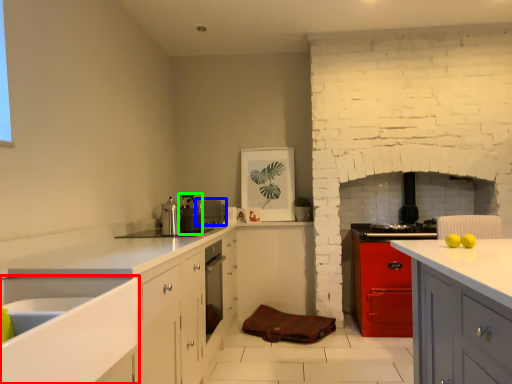
Question: Which object is positioned farthest from sink (highlighted by a red box)? Select from appliance (highlighted by a blue box) and appliance (highlighted by a green box).

Choices:
 (A) appliance
 (B) appliance

Answer: (A)